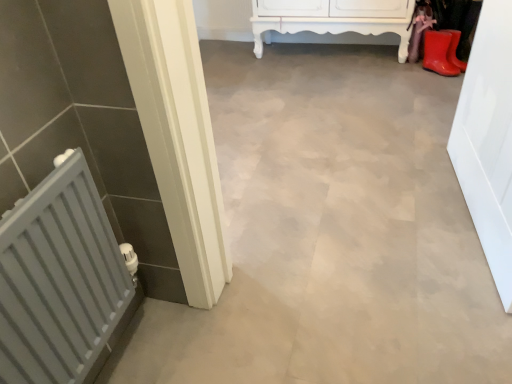
The width and height of the screenshot is (512, 384). What are the coordinates of `vacant space situated on the left part of white glossy door at right` in the screenshot? It's located at (365, 211).